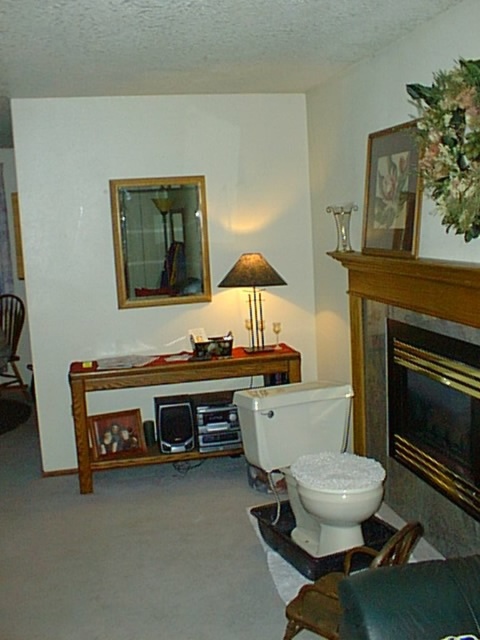
Question: Among these objects, which one is farthest from the camera?

Choices:
 (A) matte black lampshade at center
 (B) leather couch at lower right
 (C) wooden picture frame at center
 (D) wooden armchair at left

Answer: (D)

Question: Can you confirm if white glossy toilet at lower center is positioned below gold/glass picture frame at upper center?

Choices:
 (A) yes
 (B) no

Answer: (A)

Question: Which of the following is the farthest from the observer?

Choices:
 (A) (10, 314)
 (B) (304, 528)
 (C) (248, 282)

Answer: (A)

Question: Is white glossy toilet at lower center positioned before wooden armchair at left?

Choices:
 (A) yes
 (B) no

Answer: (A)

Question: Does gold/glass picture frame at upper center come behind matte black lampshade at center?

Choices:
 (A) yes
 (B) no

Answer: (B)

Question: Which point is farther from the camera taking this photo?

Choices:
 (A) (256, 259)
 (B) (21, 332)
 (C) (245, 436)

Answer: (B)